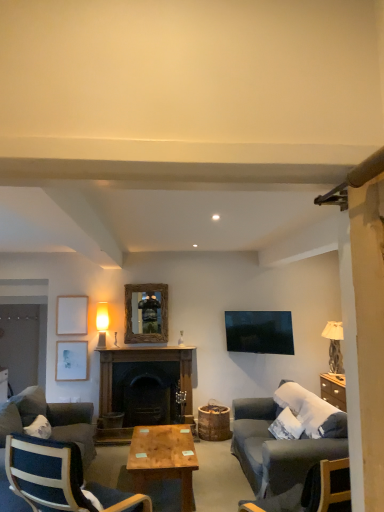
Question: Considering the positions of dark gray fabric couch at lower left, the first studio couch from the back, and matte white lampshade at upper left, the first lamp in the left-to-right sequence, in the image, is dark gray fabric couch at lower left, the first studio couch from the back, bigger or smaller than matte white lampshade at upper left, the first lamp in the left-to-right sequence,?

Choices:
 (A) small
 (B) big

Answer: (B)

Question: Is dark gray fabric couch at lower left, which is the 1th studio couch from left to right, in front of or behind matte white lampshade at upper left, the second lamp positioned from the right, in the image?

Choices:
 (A) front
 (B) behind

Answer: (A)

Question: Which is farther from the matte white picture frame at left, which is the 2th picture frame in left-to-right order?

Choices:
 (A) dark gray fabric couch at lower right, placed as the 1th studio couch when sorted from right to left
 (B) matte white lampshade at upper left, the second lamp positioned from the right
 (C) wooden polished coffee table at center
 (D) white matte picture frame at upper left, the 3th picture frame positioned from the right
 (E) dark gray fabric couch at lower left, placed as the second studio couch when sorted from right to left

Answer: (A)

Question: Estimate the real-world distances between objects in this image. Which object is closer to the wooden polished coffee table at center?

Choices:
 (A) dark wood fireplace at center
 (B) dark gray fabric couch at lower left, which is the 1th studio couch from left to right
 (C) dark gray fabric couch at lower right, which is counted as the first studio couch, starting from the front
 (D) white matte picture frame at upper left, which ranks as the 1th picture frame in left-to-right order
 (E) dark blue fabric chair at lower left

Answer: (B)